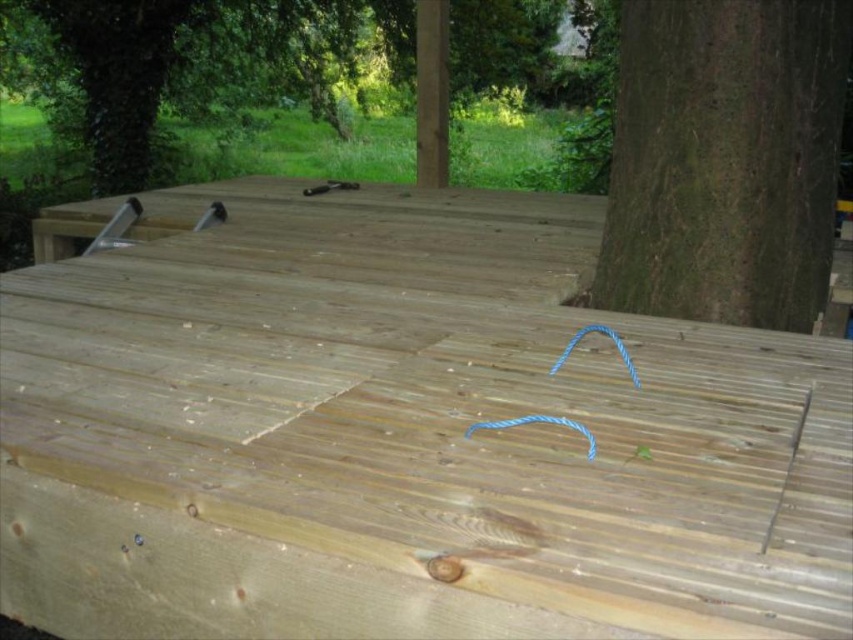
Question: Among these points, which one is nearest to the camera?

Choices:
 (A) (616, 228)
 (B) (73, 116)
 (C) (316, 419)

Answer: (C)

Question: Is green rough bark tree at right thinner than green rough bark tree at upper left?

Choices:
 (A) yes
 (B) no

Answer: (B)

Question: Is green rough bark tree at right bigger than green rough bark tree at upper left?

Choices:
 (A) yes
 (B) no

Answer: (A)

Question: Which object is positioned farthest from the green rough bark tree at upper left?

Choices:
 (A) natural wood deck at center
 (B) green rough bark tree at right

Answer: (B)

Question: Which object is farther from the camera taking this photo?

Choices:
 (A) green rough bark tree at upper left
 (B) green rough bark tree at right
 (C) natural wood deck at center

Answer: (A)

Question: Is natural wood deck at center above green rough bark tree at upper left?

Choices:
 (A) no
 (B) yes

Answer: (A)